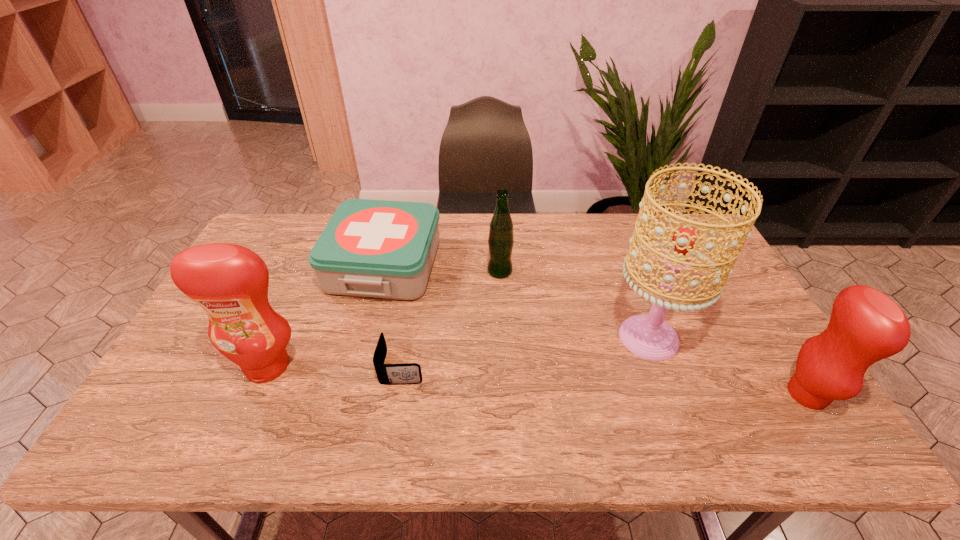
Please determine a free point for an extra condiment to ensure balance. Please provide its 2D coordinates. Your answer should be formatted as a tuple, i.e. [(x, y)], where the tuple contains the x and y coordinates of a point satisfying the conditions above.

[(530, 380)]